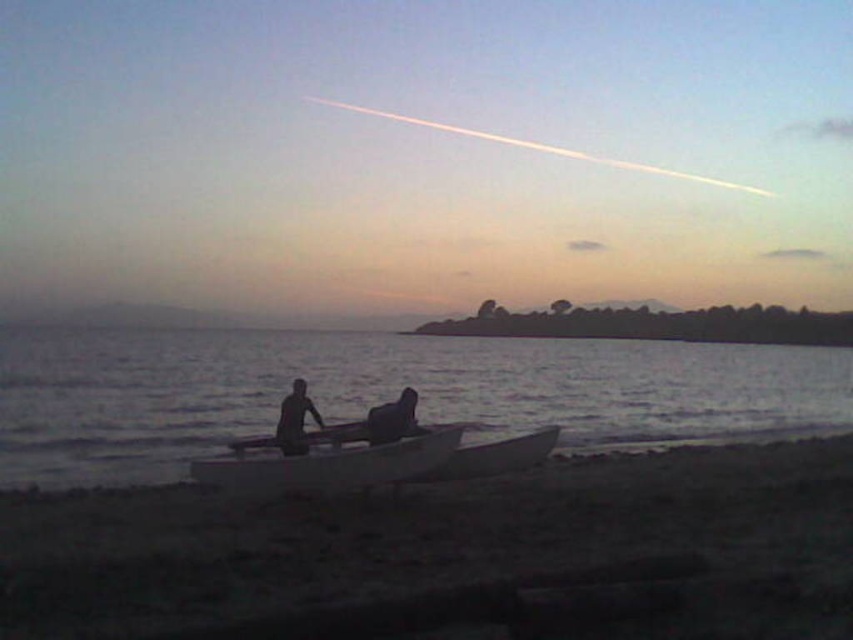
Can you confirm if smooth water at boat right is positioned to the left of smooth gray boat at center?

Yes, smooth water at boat right is to the left of smooth gray boat at center.

Which is more to the right, smooth water at boat right or smooth gray boat at center?

smooth gray boat at center

Which is behind, point (344, 381) or point (485, 464)?

Point (344, 381)

Identify the location of smooth water at boat right. The image size is (853, 640). 381,392.

Does dark matte skin at center appear on the left side of smooth dark skin at center?

Indeed, dark matte skin at center is positioned on the left side of smooth dark skin at center.

Does dark matte skin at center have a lesser height compared to smooth dark skin at center?

No.

The height and width of the screenshot is (640, 853). I want to click on dark matte skin at center, so coord(294,419).

Image resolution: width=853 pixels, height=640 pixels. What are the coordinates of `dark matte skin at center` in the screenshot? It's located at (294, 419).

Is silhouette skin couple at center bigger than smooth gray boat at center?

Incorrect, silhouette skin couple at center is not larger than smooth gray boat at center.

Is point (393, 420) less distant than point (468, 452)?

Yes, point (393, 420) is in front of point (468, 452).

You are a GUI agent. You are given a task and a screenshot of the screen. Output one action in this format:
    pyautogui.click(x=<x>, y=<y>)
    Task: Click on the silhouette skin couple at center
    The height and width of the screenshot is (640, 853).
    Given the screenshot: What is the action you would take?
    pyautogui.click(x=294, y=420)